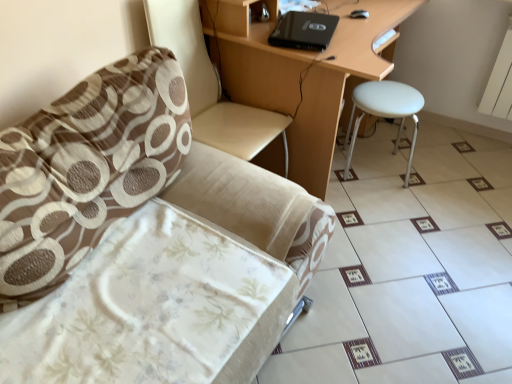
What are the coordinates of `free spot to the right of white matte stool at right` in the screenshot? It's located at (441, 173).